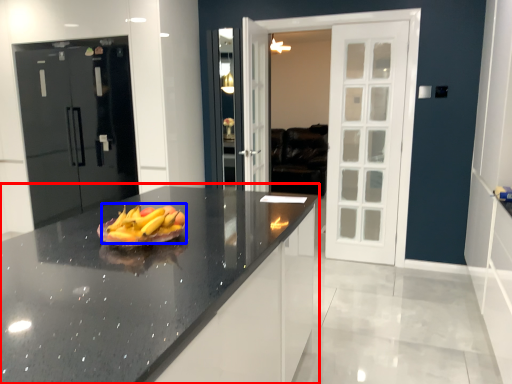
Question: Which point is further to the camera, countertop (highlighted by a red box) or grapefruit (highlighted by a blue box)?

Choices:
 (A) countertop
 (B) grapefruit

Answer: (B)